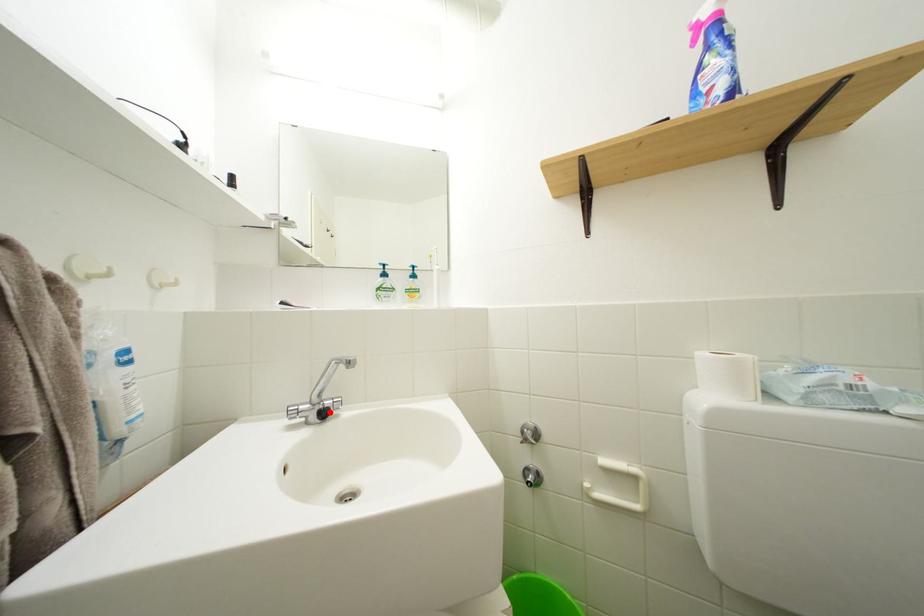
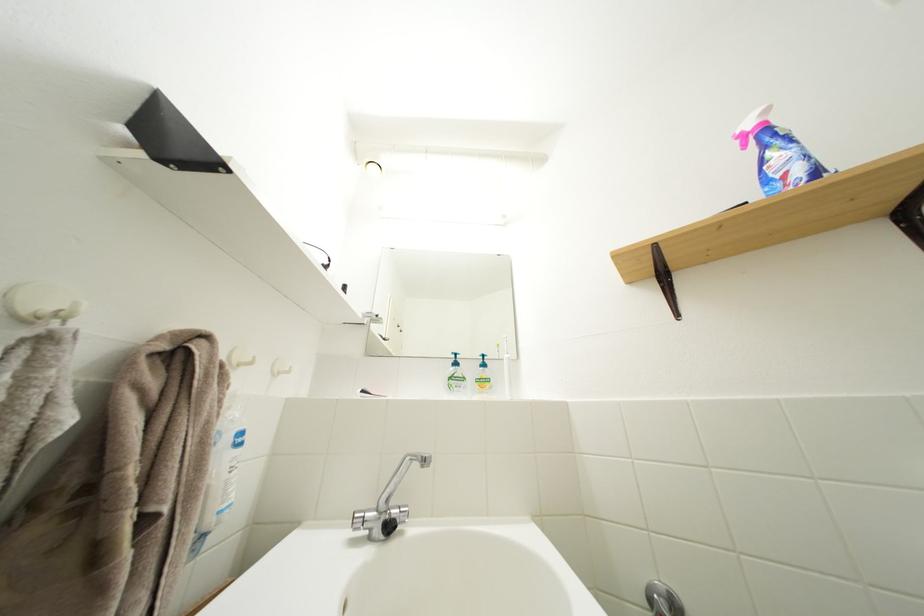
In the second image, find the point that corresponds to the highlighted location in the first image.

(396, 523)